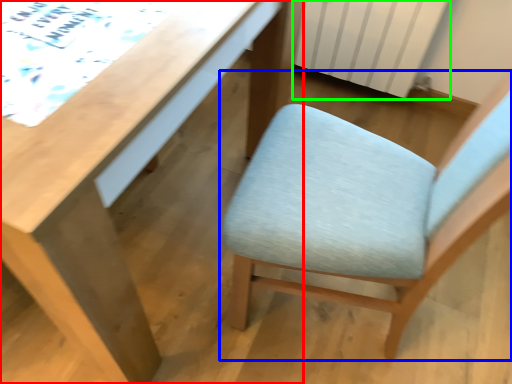
Question: Considering the real-world distances, which object is closest to desk (highlighted by a red box)? chair (highlighted by a blue box) or radiator (highlighted by a green box).

Choices:
 (A) chair
 (B) radiator

Answer: (A)